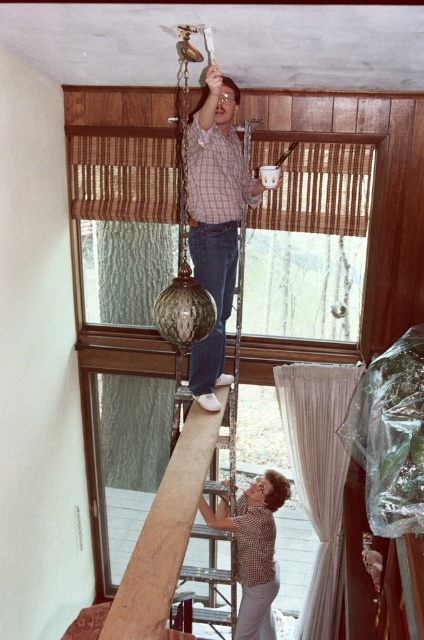
Which is below, matte plaid shirt at center or brown wooden beam at center?

brown wooden beam at center is below.

Does matte plaid shirt at center have a greater height compared to brown wooden beam at center?

Correct, matte plaid shirt at center is much taller as brown wooden beam at center.

Between point (237, 230) and point (167, 596), which one is positioned in front?

Point (167, 596)

Find the location of a particular element. This screenshot has height=640, width=424. matte plaid shirt at center is located at coordinates (215, 221).

Can you confirm if brown wooden beam at center is positioned above checkered shirt at center?

Indeed, brown wooden beam at center is positioned over checkered shirt at center.

Locate an element on the screen. The height and width of the screenshot is (640, 424). brown wooden beam at center is located at coordinates (164, 532).

Where is `brown wooden beam at center`? brown wooden beam at center is located at coordinates (164, 532).

Can you confirm if matte plaid shirt at center is shorter than checkered shirt at center?

Incorrect, matte plaid shirt at center's height does not fall short of checkered shirt at center's.

Does matte plaid shirt at center have a smaller size compared to checkered shirt at center?

Actually, matte plaid shirt at center might be larger than checkered shirt at center.

Between point (217, 362) and point (257, 554), which one is positioned behind?

The point (257, 554) is more distant.

At what (x,y) coordinates should I click in order to perform the action: click on matte plaid shirt at center. Please return your answer as a coordinate pair (x, y). The image size is (424, 640). Looking at the image, I should click on click(215, 221).